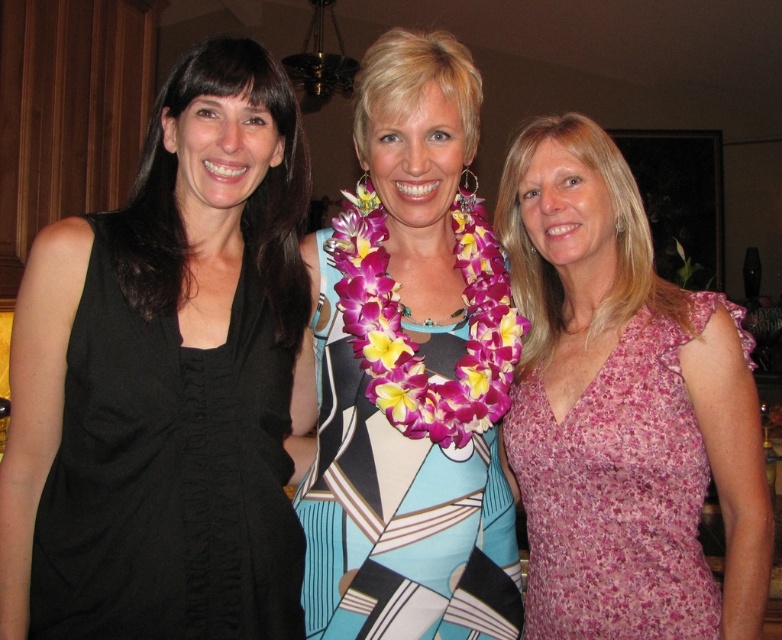
Is printed fabric dress at center above black fabric dress at left?

Indeed, printed fabric dress at center is positioned over black fabric dress at left.

Between point (388, 97) and point (92, 460), which one is positioned in front?

Positioned in front is point (92, 460).

I want to click on printed fabric dress at center, so click(x=393, y=504).

Who is positioned more to the right, pink floral dress at right or floral lei at center?

Positioned to the right is pink floral dress at right.

Is pink floral dress at right smaller than floral lei at center?

No, pink floral dress at right is not smaller than floral lei at center.

Locate an element on the screen. The width and height of the screenshot is (782, 640). pink floral dress at right is located at coordinates (622, 408).

Can you confirm if black fabric dress at left is positioned below floral lei at center?

Yes, black fabric dress at left is below floral lei at center.

In the scene shown: Is black fabric dress at left wider than floral lei at center?

Indeed, black fabric dress at left has a greater width compared to floral lei at center.

Which is behind, point (63, 589) or point (357, 352)?

Positioned behind is point (357, 352).

Find the location of a particular element. The height and width of the screenshot is (640, 782). black fabric dress at left is located at coordinates (167, 476).